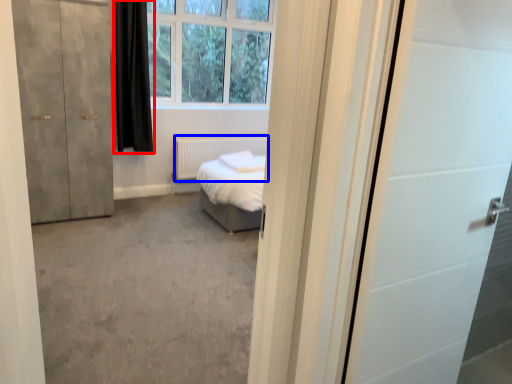
Question: Which point is further to the camera, curtain (highlighted by a red box) or radiator (highlighted by a blue box)?

Choices:
 (A) curtain
 (B) radiator

Answer: (B)